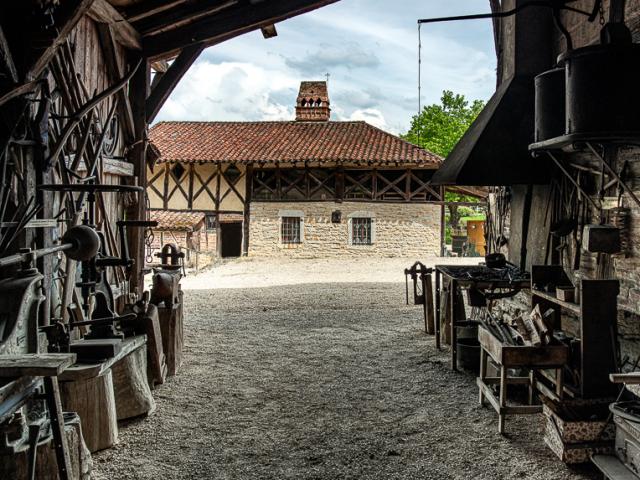
This screenshot has width=640, height=480. Find the location of `basket holding items`. basket holding items is located at coordinates (580, 432).